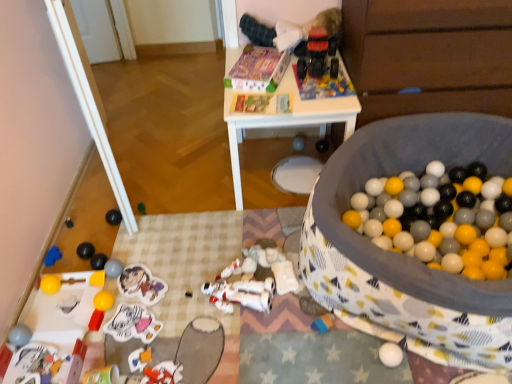
What are the coordinates of `free space in front of white fabric doll at center, placed as the fifth toy when sorted from right to left` in the screenshot? It's located at (288, 323).